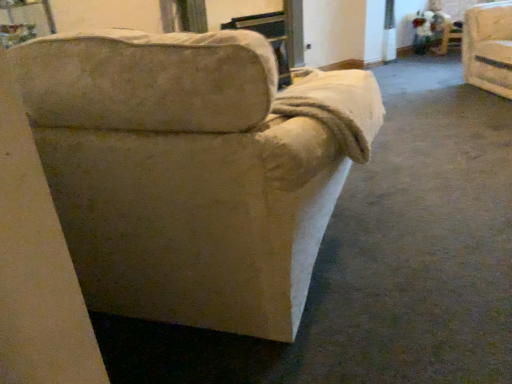
You are a GUI agent. You are given a task and a screenshot of the screen. Output one action in this format:
    pyautogui.click(x=<x>, y=<y>)
    Task: Click on the beige fabric couch at center
    
    Given the screenshot: What is the action you would take?
    pyautogui.click(x=192, y=170)

The image size is (512, 384). Describe the element at coordinates (192, 170) in the screenshot. I see `beige fabric couch at center` at that location.

Find the location of a particular element. beige fabric couch at center is located at coordinates (192, 170).